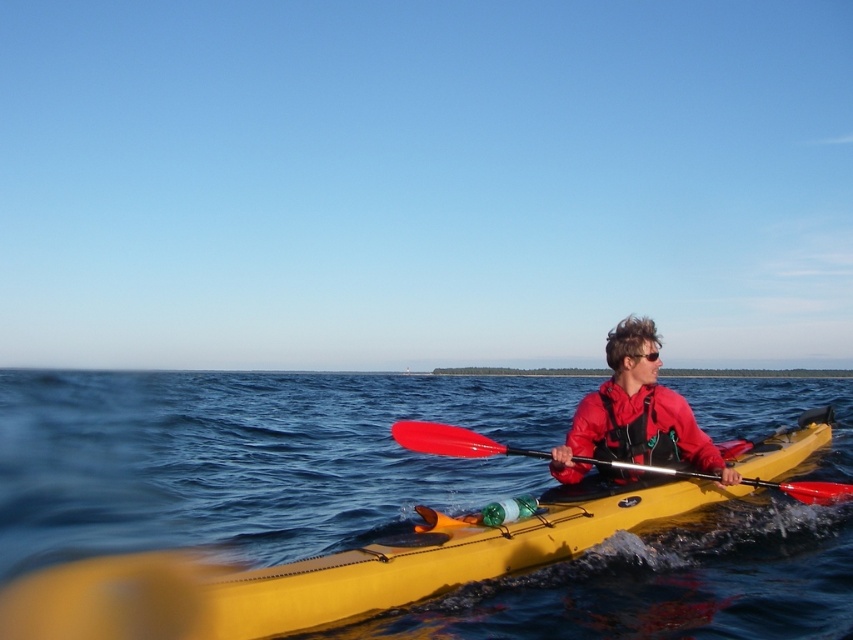
Is red matte jacket at center below red plastic paddle at center?

No.

Which of these two, red matte jacket at center or red plastic paddle at center, stands taller?

red plastic paddle at center

Measure the distance between point (653, 342) and camera.

Point (653, 342) and camera are 17.90 feet apart from each other.

Image resolution: width=853 pixels, height=640 pixels. I want to click on red matte jacket at center, so click(635, 413).

Is blue water at center further to camera compared to red matte jacket at center?

No, blue water at center is closer to the viewer.

Is point (173, 536) positioned after point (636, 451)?

Yes, it is behind point (636, 451).

Between point (74, 412) and point (619, 353), which one is positioned in front?

Point (619, 353)

I want to click on blue water at center, so click(247, 458).

Is point (683, 557) closer to viewer compared to point (843, 497)?

Yes, it is.

Who is positioned more to the left, blue water at center or red plastic paddle at center?

Positioned to the left is red plastic paddle at center.

The image size is (853, 640). What do you see at coordinates (247, 458) in the screenshot?
I see `blue water at center` at bounding box center [247, 458].

Find the location of a particular element. The image size is (853, 640). blue water at center is located at coordinates (247, 458).